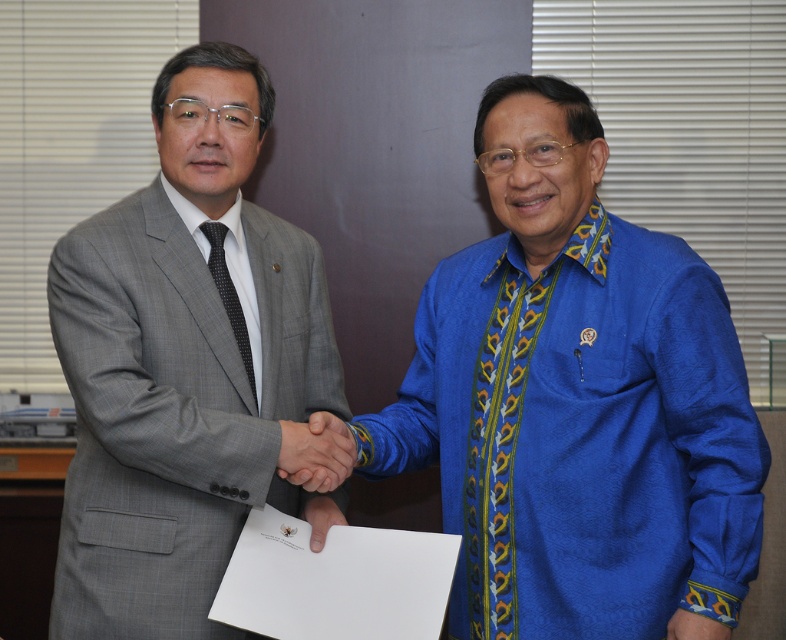
You are standing at the origin of the coordinate system in the image. You see two points, point (709, 513) and point (230, 317). Which point is closer to you?

Point (709, 513) is in front of point (230, 317), so it is closer to you.